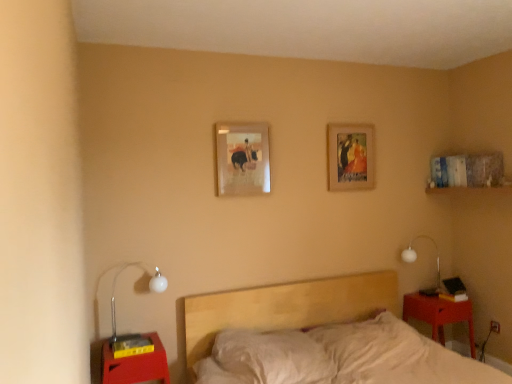
Question: From a real-world perspective, is matte red nightstand at lower left, which is the first nightstand in front-to-back order, positioned above or below wooden picture frame at upper center, the 2th picture frame from the front?

Choices:
 (A) above
 (B) below

Answer: (B)

Question: Looking at the image, does matte red nightstand at lower left, the first nightstand when ordered from left to right, seem bigger or smaller compared to wooden picture frame at upper center, arranged as the 1th picture frame when viewed from the right?

Choices:
 (A) small
 (B) big

Answer: (B)

Question: Which of these objects is positioned farthest from the matte wooden picture frame at center, which is counted as the 2th picture frame, starting from the back?

Choices:
 (A) matte red nightstand at lower left, acting as the 2th nightstand starting from the back
 (B) matte red wood nightstand at lower right, arranged as the 2th nightstand when viewed from the left
 (C) wooden picture frame at upper center, the first picture frame viewed from the back
 (D) white glass lamp at right, which ranks as the first lamp in back-to-front order
 (E) white glass lamp at left, which is counted as the 2th lamp, starting from the right

Answer: (B)

Question: Estimate the real-world distances between objects in this image. Which object is closer to the matte red wood nightstand at lower right, marked as the first nightstand in a right-to-left arrangement?

Choices:
 (A) white glass lamp at right, the first lamp from the right
 (B) wooden picture frame at upper center, the 2th picture frame from the front
 (C) light wood bed at center
 (D) matte wooden picture frame at center, which is counted as the 2th picture frame, starting from the back
 (E) matte red nightstand at lower left, which is the first nightstand in front-to-back order

Answer: (A)